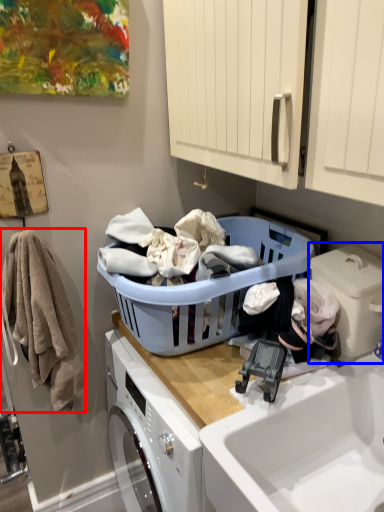
Question: Among these objects, which one is farthest to the camera, clothing (highlighted by a red box) or washing machine (highlighted by a blue box)?

Choices:
 (A) clothing
 (B) washing machine

Answer: (A)